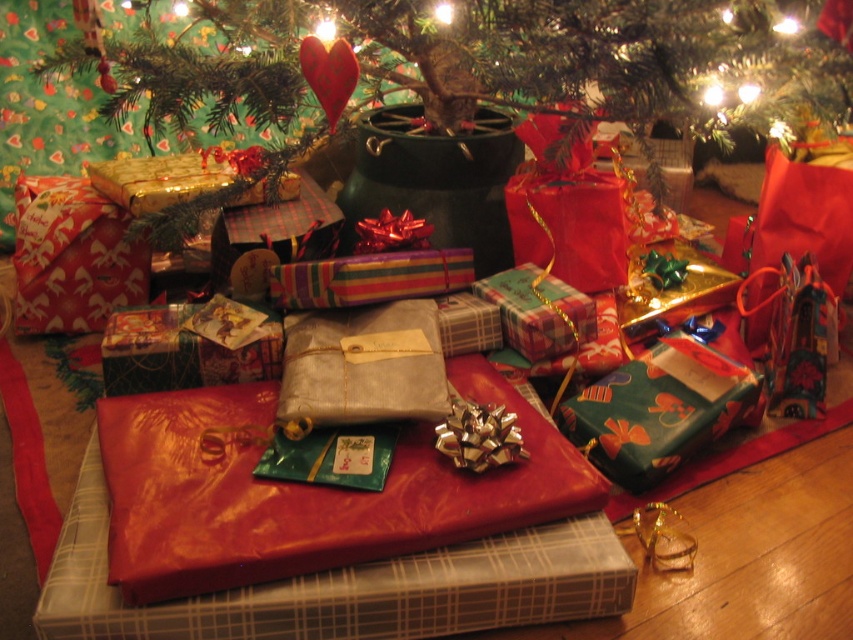
Which is below, green paper gift at center or red shiny paper gift at left?

green paper gift at center

This screenshot has width=853, height=640. What are the coordinates of `green paper gift at center` in the screenshot? It's located at (659, 410).

Between red shiny paper gift at left and plaid paper gift at center, which one appears on the right side from the viewer's perspective?

From the viewer's perspective, plaid paper gift at center appears more on the right side.

Does red shiny paper gift at left have a lesser width compared to plaid paper gift at center?

No, red shiny paper gift at left is not thinner than plaid paper gift at center.

Is point (55, 284) behind point (578, 305)?

Yes, point (55, 284) is farther from viewer.

At what (x,y) coordinates should I click in order to perform the action: click on red shiny paper gift at left. Please return your answer as a coordinate pair (x, y). The height and width of the screenshot is (640, 853). Looking at the image, I should click on (x=73, y=257).

Who is positioned more to the left, green matte christmas tree at center or green paper gift at center?

green matte christmas tree at center is more to the left.

Is green matte christmas tree at center positioned behind green paper gift at center?

That is False.

Find the location of a particular element. green matte christmas tree at center is located at coordinates click(x=498, y=60).